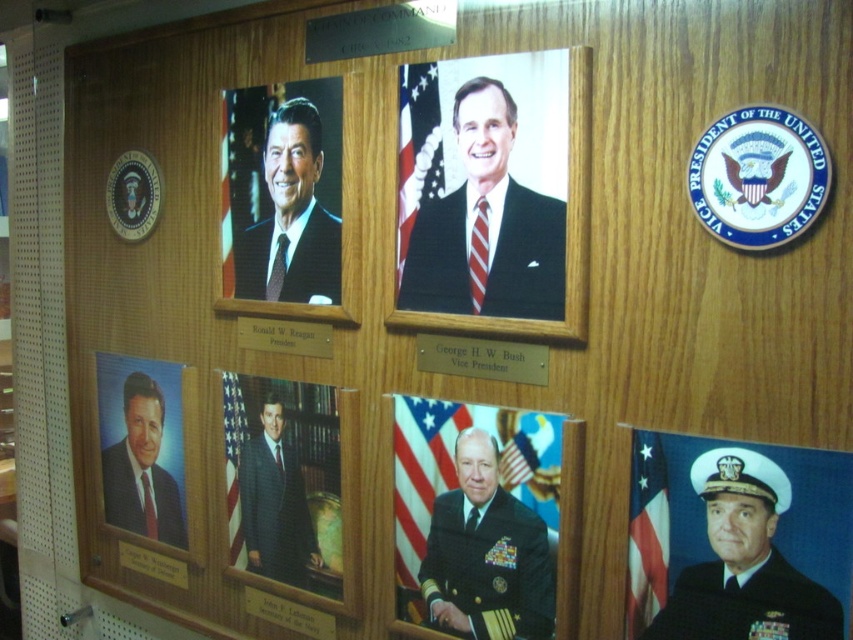
Between navy blue uniform at lower right and navy blue fabric at center, which one is positioned lower?

navy blue fabric at center is lower down.

Is point (756, 570) more distant than point (527, 580)?

No, it is not.

Find the location of a particular element. navy blue uniform at lower right is located at coordinates (746, 561).

Does matte black suit at upper center appear over navy blue uniform at lower right?

Yes.

Find the location of a particular element. The width and height of the screenshot is (853, 640). matte black suit at upper center is located at coordinates (486, 225).

Which is more to the right, matte black portrait at lower left or matte black suit at lower left?

matte black portrait at lower left

Can you confirm if matte black portrait at lower left is positioned to the right of matte black suit at lower left?

Yes, matte black portrait at lower left is to the right of matte black suit at lower left.

Who is more forward, (138, 365) or (103, 490)?

Positioned in front is point (138, 365).

Where is `matte black portrait at lower left`? The image size is (853, 640). matte black portrait at lower left is located at coordinates (146, 444).